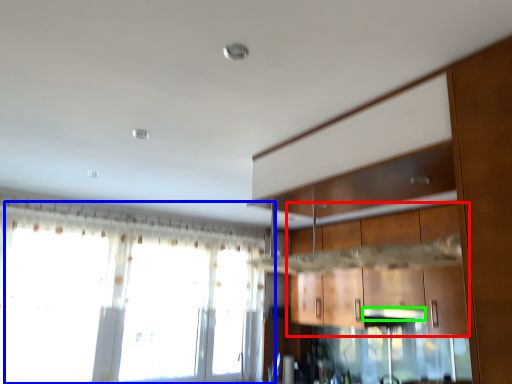
Question: Which object is positioned closest to cabinetry (highlighted by a red box)? Select from window (highlighted by a blue box) and exhaust hood (highlighted by a green box).

Choices:
 (A) window
 (B) exhaust hood

Answer: (B)